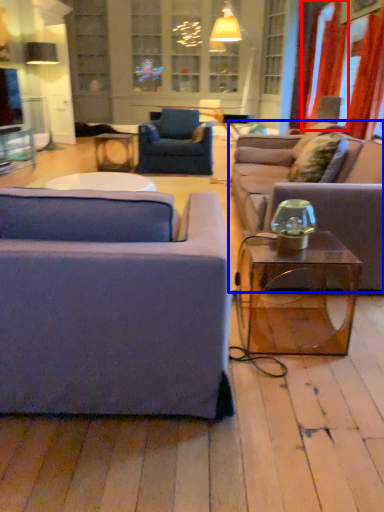
Question: Which object appears farthest to the camera in this image, curtain (highlighted by a red box) or studio couch (highlighted by a blue box)?

Choices:
 (A) curtain
 (B) studio couch

Answer: (A)